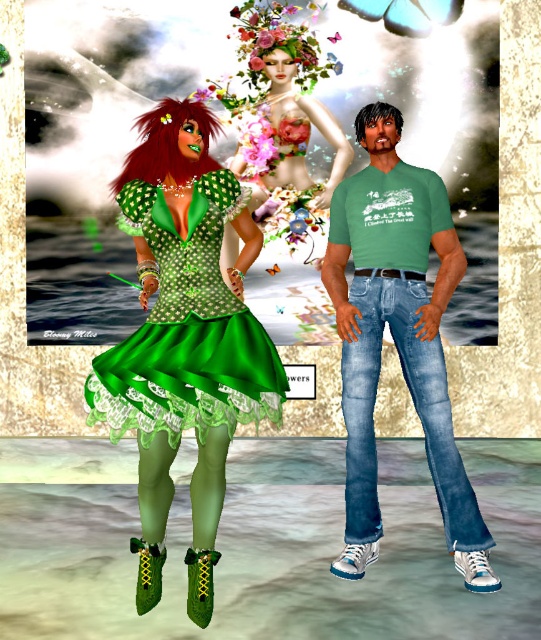
In the scene described, there are two outfits visible. The first is the green polka dot fabric dress at left, and the second is the blue denim jeans at center. Which of these two outfits takes up more visual space in the image?

The green polka dot fabric dress at left takes up more visual space in the image because it is bigger than the blue denim jeans at center.

Based on the scene description, which object is taller between the blue denim jeans at center and the dark brown matte hair at upper center?

The blue denim jeans at center is much taller than the dark brown matte hair at upper center according to the description.